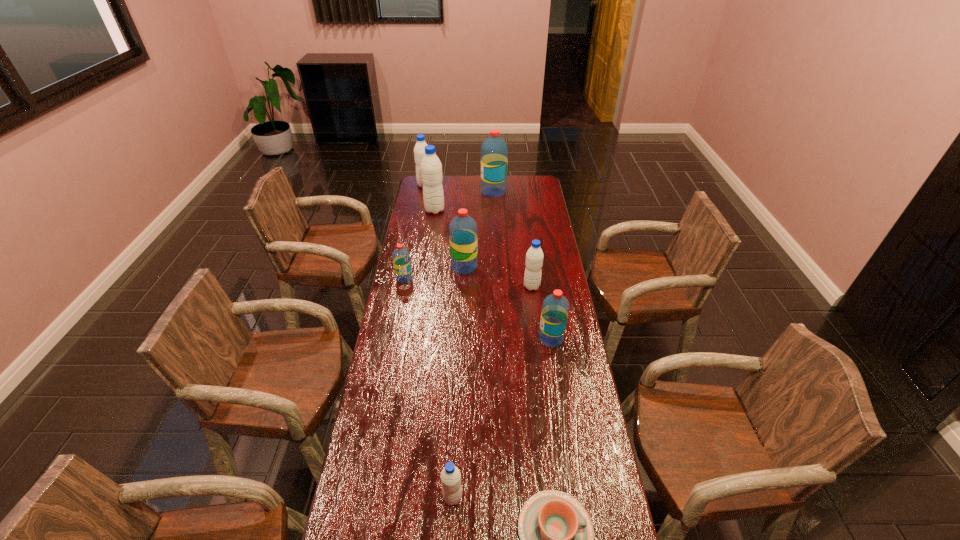
Where is `blank region between the biggest red water bottle and the nearest red water bottle`? The width and height of the screenshot is (960, 540). blank region between the biggest red water bottle and the nearest red water bottle is located at coordinates (x=522, y=265).

Where is `free space between the leftmost red water bottle and the rightmost gray water bottle`? free space between the leftmost red water bottle and the rightmost gray water bottle is located at coordinates (468, 282).

Image resolution: width=960 pixels, height=540 pixels. I want to click on vacant area that lies between the smallest gray water bottle and the second farthest gray water bottle, so click(444, 354).

The height and width of the screenshot is (540, 960). Find the location of `free point between the leftmost red water bottle and the farthest gray water bottle`. free point between the leftmost red water bottle and the farthest gray water bottle is located at coordinates (415, 232).

Where is `vacant region between the farthest gray water bottle and the second nearest gray water bottle`? This screenshot has height=540, width=960. vacant region between the farthest gray water bottle and the second nearest gray water bottle is located at coordinates (478, 236).

Where is `free space between the nearest gray water bottle and the third red water bottle from right to left`? This screenshot has height=540, width=960. free space between the nearest gray water bottle and the third red water bottle from right to left is located at coordinates (459, 382).

I want to click on object that can be found as the fifth closest to the nearest water bottle, so click(x=462, y=229).

Identify which object is the eighth closest to the second red water bottle from right to left. Please provide its 2D coordinates. Your answer should be formatted as a tuple, i.e. [(x, y)], where the tuple contains the x and y coordinates of a point satisfying the conditions above.

[(556, 533)]

You are a GUI agent. You are given a task and a screenshot of the screen. Output one action in this format:
    pyautogui.click(x=<x>, y=<y>)
    Task: Click on the seventh closest water bottle to the second nearest water bottle
    This screenshot has height=540, width=960.
    Given the screenshot: What is the action you would take?
    pyautogui.click(x=419, y=150)

Where is `the seventh closest water bottle relative to the sixth nearest water bottle`? The height and width of the screenshot is (540, 960). the seventh closest water bottle relative to the sixth nearest water bottle is located at coordinates (450, 476).